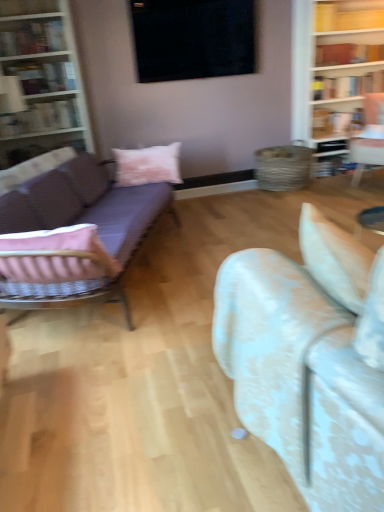
The height and width of the screenshot is (512, 384). In order to click on hardcover book at upper right, acting as the first book starting from the right in this screenshot , I will do `click(347, 86)`.

Describe the element at coordinates (347, 86) in the screenshot. The image size is (384, 512). I see `hardcover book at upper right, placed as the 4th book when sorted from left to right` at that location.

What do you see at coordinates (41, 81) in the screenshot?
I see `wooden bookshelf at left` at bounding box center [41, 81].

This screenshot has height=512, width=384. Find the location of `yellow wood shelf at upper right`. yellow wood shelf at upper right is located at coordinates (349, 15).

From a real-world perspective, is purple fabric couch at left, acting as the second studio couch starting from the right, positioned above or below matte white bookshelf at left, placed as the fourth book when sorted from right to left?

Clearly, from a real-world perspective, purple fabric couch at left, acting as the second studio couch starting from the right, is below matte white bookshelf at left, placed as the fourth book when sorted from right to left.

Choose the correct answer: Is purple fabric couch at left, the first studio couch positioned from the left, inside matte white bookshelf at left, arranged as the second book when viewed from the front, or outside it?

purple fabric couch at left, the first studio couch positioned from the left, is not inside matte white bookshelf at left, arranged as the second book when viewed from the front, it's outside.

Which book is the 2nd one when counting from the back of the purple fabric couch at left, which is counted as the first studio couch, starting from the back? Please provide its 2D coordinates.

[(41, 118)]

How distant is matte black bookshelf at upper left, positioned as the 1th book in front-to-back order, from matte white bookshelf at left, the 3th book in the back-to-front sequence?

matte black bookshelf at upper left, positioned as the 1th book in front-to-back order, and matte white bookshelf at left, the 3th book in the back-to-front sequence, are 22.24 inches apart from each other.

How different are the orientations of matte black bookshelf at upper left, which appears as the 3th book when viewed from the right, and matte white bookshelf at left, the 3th book in the back-to-front sequence, in degrees?

There is a 0.251-degree angle between the facing directions of matte black bookshelf at upper left, which appears as the 3th book when viewed from the right, and matte white bookshelf at left, the 3th book in the back-to-front sequence.

Considering the positions of objects matte black bookshelf at upper left, the second book from the left, and matte white bookshelf at left, placed as the fourth book when sorted from right to left, in the image provided, who is in front, matte black bookshelf at upper left, the second book from the left, or matte white bookshelf at left, placed as the fourth book when sorted from right to left,?

matte black bookshelf at upper left, the second book from the left, is in front.

From the image's perspective, between matte black bookshelf at upper left, the fourth book positioned from the back, and matte white bookshelf at left, the 3th book in the back-to-front sequence, which one is located above?

matte black bookshelf at upper left, the fourth book positioned from the back, from the image's perspective.

Based on the photo, does matte black bookshelf at upper left, the second book from the left, have a lesser height compared to black matte window at upper center?

Yes.

Based on their sizes in the image, would you say matte black bookshelf at upper left, the second book from the left, is bigger or smaller than black matte window at upper center?

Considering their sizes, matte black bookshelf at upper left, the second book from the left, takes up less space than black matte window at upper center.

Is matte black bookshelf at upper left, positioned as the 1th book in front-to-back order, wider than black matte window at upper center?

Indeed, matte black bookshelf at upper left, positioned as the 1th book in front-to-back order, has a greater width compared to black matte window at upper center.

In the scene shown: Is matte black bookshelf at upper left, the fourth book positioned from the back, positioned before black matte window at upper center?

Yes, matte black bookshelf at upper left, the fourth book positioned from the back, is closer to the viewer.

How many degrees apart are the facing directions of purple fabric couch at left, acting as the second studio couch starting from the right, and yellow wood shelf at upper right?

The facing directions of purple fabric couch at left, acting as the second studio couch starting from the right, and yellow wood shelf at upper right are 64.5 degrees apart.

Looking at this image, who is smaller, purple fabric couch at left, acting as the second studio couch starting from the right, or yellow wood shelf at upper right?

yellow wood shelf at upper right is smaller.

Between purple fabric couch at left, acting as the second studio couch starting from the right, and yellow wood shelf at upper right, which one has smaller width?

yellow wood shelf at upper right.

Would you consider wooden bookshelf at left to be distant from hardcover book at upper right, acting as the first book starting from the right?

wooden bookshelf at left is positioned a significant distance from hardcover book at upper right, acting as the first book starting from the right.

Is wooden bookshelf at left positioned with its back to hardcover book at upper right, the 2th book from the back?

No, wooden bookshelf at left's orientation is not away from hardcover book at upper right, the 2th book from the back.

Is wooden bookshelf at left taller than hardcover book at upper right, placed as the 4th book when sorted from left to right?

Correct, wooden bookshelf at left is much taller as hardcover book at upper right, placed as the 4th book when sorted from left to right.

The image size is (384, 512). What are the coordinates of `the 3rd book behind the wooden bookshelf at left` in the screenshot? It's located at (347, 86).

Which is more to the left, velvet beige armchair at right or white floral fabric couch at center, the 2th studio couch positioned from the back?

Positioned to the left is white floral fabric couch at center, the 2th studio couch positioned from the back.

The width and height of the screenshot is (384, 512). There is a velvet beige armchair at right. Find the location of `the 2nd studio couch below it (from the image's perspective)`. the 2nd studio couch below it (from the image's perspective) is located at coordinates (304, 368).

Does velvet beige armchair at right turn towards white floral fabric couch at center, the first studio couch positioned from the right?

Yes.

How distant is matte white bookshelf at left, placed as the fourth book when sorted from right to left, from purple fabric couch at left, acting as the second studio couch starting from the right?

A distance of 3.92 feet exists between matte white bookshelf at left, placed as the fourth book when sorted from right to left, and purple fabric couch at left, acting as the second studio couch starting from the right.

Considering the relative positions of matte white bookshelf at left, the 3th book in the back-to-front sequence, and purple fabric couch at left, the first studio couch positioned from the left, in the image provided, is matte white bookshelf at left, the 3th book in the back-to-front sequence, to the right of purple fabric couch at left, the first studio couch positioned from the left, from the viewer's perspective?

In fact, matte white bookshelf at left, the 3th book in the back-to-front sequence, is to the left of purple fabric couch at left, the first studio couch positioned from the left.

From a real-world perspective, is matte white bookshelf at left, arranged as the second book when viewed from the front, positioned under purple fabric couch at left, which is counted as the first studio couch, starting from the back, based on gravity?

No, from a real-world perspective, matte white bookshelf at left, arranged as the second book when viewed from the front, is not under purple fabric couch at left, which is counted as the first studio couch, starting from the back.

Is point (25, 119) closer or farther from the camera than point (24, 304)?

Clearly, point (25, 119) is more distant from the camera than point (24, 304).

There is a matte white bookshelf at left, placed as the fourth book when sorted from right to left. Where is `the 1st studio couch below it (from the image's perspective)`? The height and width of the screenshot is (512, 384). the 1st studio couch below it (from the image's perspective) is located at coordinates [x=84, y=223].

Starting from the matte black bookshelf at upper left, which appears as the 3th book when viewed from the right, which book is the 1st one behind? Please provide its 2D coordinates.

[(41, 118)]

Looking at the image, which one is located closer to yellow wood shelf at upper right, hardcover book at upper right, which ranks as the 2th book in right-to-left order, or pink cotton pillow at center?

hardcover book at upper right, which ranks as the 2th book in right-to-left order.

When comparing their distances from velvet beige armchair at right, does yellow wood shelf at upper right or matte black bookshelf at upper left, the fourth book positioned from the back, seem closer?

yellow wood shelf at upper right.

From the image, which object appears to be nearer to matte white bookshelf at left, arranged as the second book when viewed from the front, yellow wood shelf at upper right or matte black bookshelf at upper left, the second book from the left?

The object closer to matte white bookshelf at left, arranged as the second book when viewed from the front, is matte black bookshelf at upper left, the second book from the left.

From the picture: Looking at the image, which one is located closer to purple fabric couch at left, acting as the second studio couch starting from the right, matte black bookshelf at upper left, the second book from the left, or wooden bookshelf at left?

wooden bookshelf at left lies closer to purple fabric couch at left, acting as the second studio couch starting from the right, than the other object.

When comparing their distances from hardcover book at upper right, which ranks as the 2th book in right-to-left order, does white floral fabric couch at center, the second studio couch from the left, or velvet beige armchair at right seem further?

The object further to hardcover book at upper right, which ranks as the 2th book in right-to-left order, is white floral fabric couch at center, the second studio couch from the left.

When comparing their distances from pink cotton pillow at center, does hardcover book at upper right, which is the 1th book in back-to-front order, or purple fabric couch at left, the first studio couch positioned from the left, seem closer?

purple fabric couch at left, the first studio couch positioned from the left.

Based on their spatial positions, is wooden bookshelf at left or matte black bookshelf at upper left, the fourth book positioned from the back, closer to hardcover book at upper right, positioned as the 4th book in front-to-back order?

Among the two, wooden bookshelf at left is located nearer to hardcover book at upper right, positioned as the 4th book in front-to-back order.

Looking at the image, which one is located closer to white floral fabric couch at center, the first studio couch when ordered from front to back, pink cotton pillow at center or velvet beige armchair at right?

The object closer to white floral fabric couch at center, the first studio couch when ordered from front to back, is pink cotton pillow at center.

Where is `bookcase between white floral fabric couch at center, the first studio couch when ordered from front to back, and black matte window at upper center, along the z-axis`? The image size is (384, 512). bookcase between white floral fabric couch at center, the first studio couch when ordered from front to back, and black matte window at upper center, along the z-axis is located at coordinates (41, 81).

This screenshot has height=512, width=384. Find the location of `window between wooden bookshelf at left and hardcover book at upper right, the 2th book from the back, from left to right`. window between wooden bookshelf at left and hardcover book at upper right, the 2th book from the back, from left to right is located at coordinates [x=193, y=39].

Locate an element on the screen. This screenshot has width=384, height=512. studio couch located between white floral fabric couch at center, the first studio couch when ordered from front to back, and hardcover book at upper right, the third book from the left, in the depth direction is located at coordinates (84, 223).

The image size is (384, 512). What are the coordinates of `book positioned between velvet beige armchair at right and hardcover book at upper right, positioned as the 4th book in front-to-back order, from near to far` in the screenshot? It's located at (347, 86).